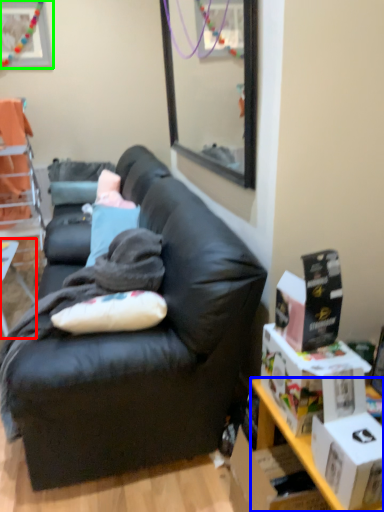
Question: Estimate the real-world distances between objects in this image. Which object is closer to table (highlighted by a red box), desk (highlighted by a blue box) or picture frame (highlighted by a green box)?

Choices:
 (A) desk
 (B) picture frame

Answer: (A)